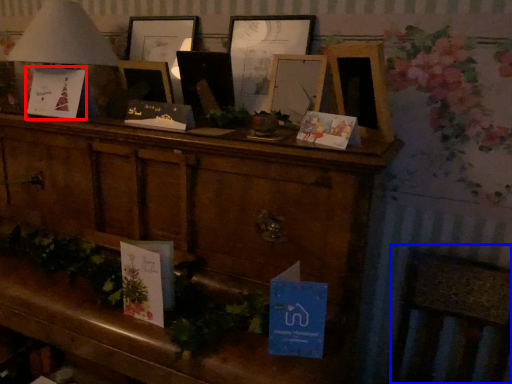
Question: Which point is closer to the camera, christmas card (highlighted by a red box) or rocking chair (highlighted by a blue box)?

Choices:
 (A) christmas card
 (B) rocking chair

Answer: (B)